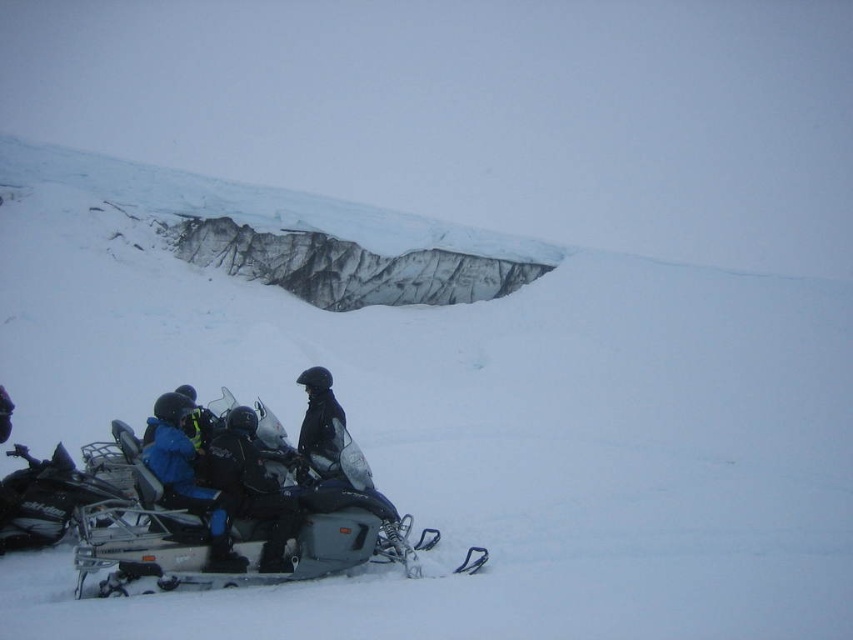
Is metallic silver snowmobile at lower left below black matte jacket at center?

Yes.

Who is more forward, (9, 524) or (321, 376)?

Point (9, 524) is in front.

At what (x,y) coordinates should I click in order to perform the action: click on metallic silver snowmobile at lower left. Please return your answer as a coordinate pair (x, y). The height and width of the screenshot is (640, 853). Looking at the image, I should click on [x=45, y=499].

Which of these two, metallic silver snowmobile at lower center or metallic silver snowmobile at lower left, stands shorter?

Standing shorter between the two is metallic silver snowmobile at lower left.

How distant is metallic silver snowmobile at lower center from metallic silver snowmobile at lower left?

A distance of 2.16 meters exists between metallic silver snowmobile at lower center and metallic silver snowmobile at lower left.

Image resolution: width=853 pixels, height=640 pixels. In order to click on metallic silver snowmobile at lower center in this screenshot , I will do `click(242, 525)`.

Is point (242, 545) less distant than point (318, 412)?

Yes, it is in front of point (318, 412).

You are a GUI agent. You are given a task and a screenshot of the screen. Output one action in this format:
    pyautogui.click(x=<x>, y=<y>)
    Task: Click on the metallic silver snowmobile at lower center
    
    Given the screenshot: What is the action you would take?
    pyautogui.click(x=242, y=525)